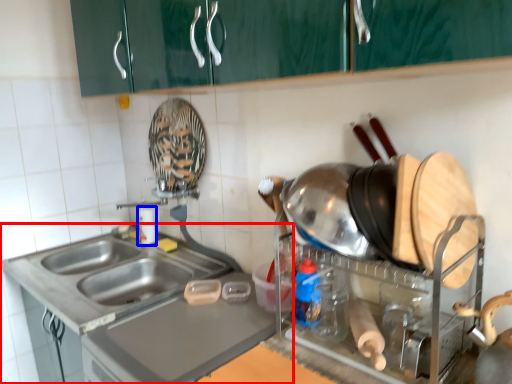
Question: Which point is further to the camera, countertop (highlighted by a red box) or bottle (highlighted by a blue box)?

Choices:
 (A) countertop
 (B) bottle

Answer: (B)